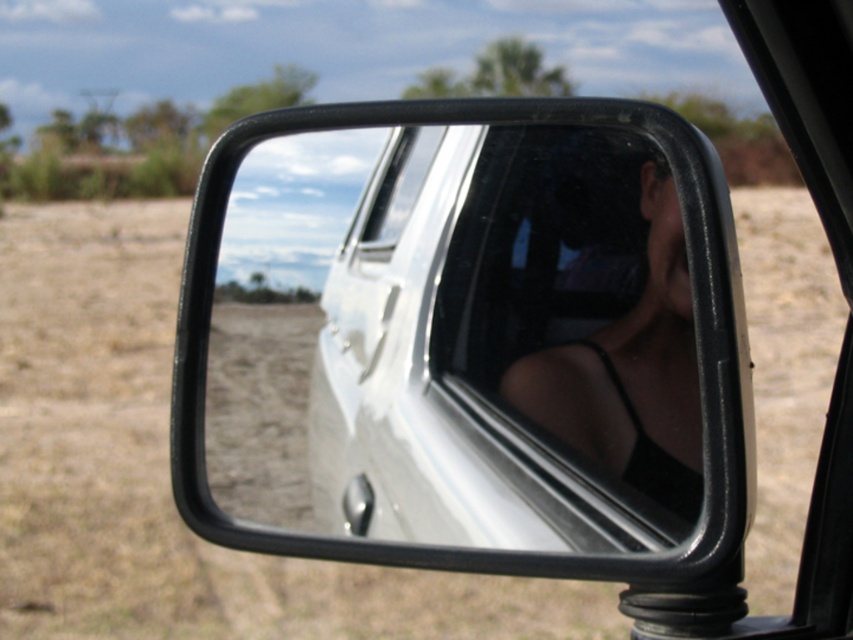
You are inside a car and looking at the side mirror. You notice a point marked at coordinates (577, 317). Based on the scene description, what object is located at this point?

The point at coordinates (577, 317) marks the transparent glass car window at center.

You are a delivery robot standing at the point marked as point [541,257]. You need to deliver a package to a location that is 1.25 meters away from you. Can you reach the destination without moving past the car door?

The distance between you and the destination is exactly 1.25 meters. Since the car door is part of the vehicle structure, you can reach the destination by moving forward 1.25 meters without crossing the car door as long as the path is clear.

You are a passenger in a car and want to check the rearview through the black glossy mirror at center and the transparent glass car window at center. Which object would allow you to see the outside environment better?

The transparent glass car window at center would allow you to see the outside environment better because the black glossy mirror at center is positioned in front of it, potentially blocking or reducing visibility through the window.